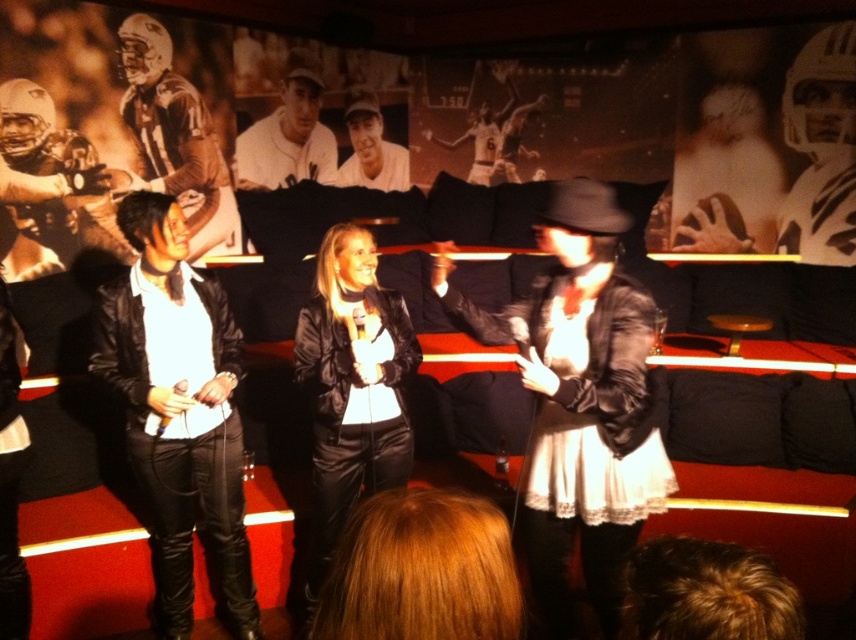
Question: Among these points, which one is nearest to the camera?

Choices:
 (A) (182, 403)
 (B) (476, 134)

Answer: (A)

Question: Does black leather jacket at center come behind white jersey at upper center?

Choices:
 (A) yes
 (B) no

Answer: (B)

Question: Is matte brown leather jacket at upper left in front of white jersey at center?

Choices:
 (A) no
 (B) yes

Answer: (B)

Question: Which point appears closest to the camera in this image?

Choices:
 (A) (547, 445)
 (B) (372, 132)
 (C) (144, 172)
 (D) (366, 337)

Answer: (A)

Question: Which is farther from the white jersey at upper center?

Choices:
 (A) matte brown leather jacket at upper left
 (B) white jersey at center
 (C) black leather jacket at center
 (D) white baseball cap at center

Answer: (C)

Question: Does black leather jacket at center appear on the left side of white jersey at upper center?

Choices:
 (A) yes
 (B) no

Answer: (B)